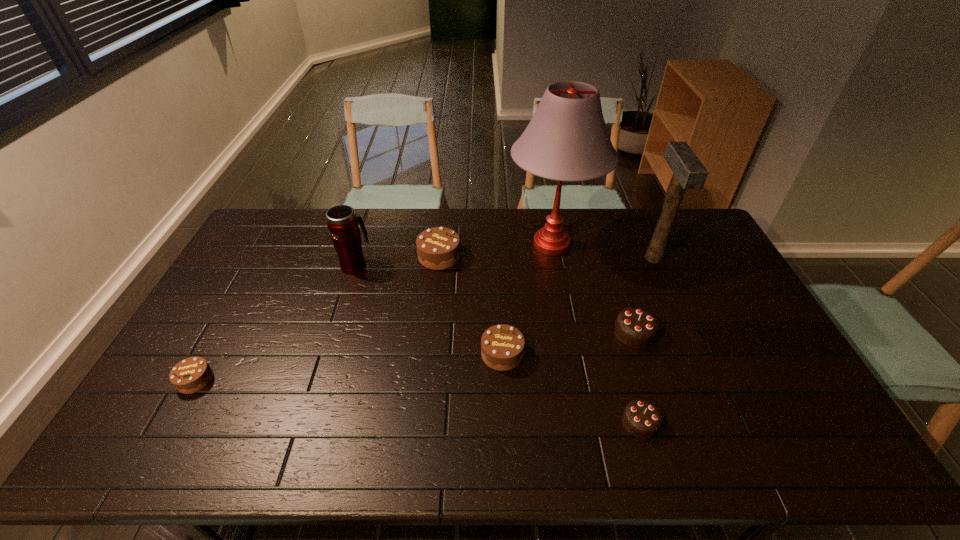
Where is `brown chocolate cake that stands as the second closest to the rightmost brown chocolate cake`? brown chocolate cake that stands as the second closest to the rightmost brown chocolate cake is located at coordinates (192, 374).

You are a GUI agent. You are given a task and a screenshot of the screen. Output one action in this format:
    pyautogui.click(x=<x>, y=<y>)
    Task: Click on the vacant region that satisfies the following two spatial constraints: 1. on the back side of the bigger chocolate chocolate cake; 2. on the left side of the smallest brown chocolate cake
    
    Given the screenshot: What is the action you would take?
    pyautogui.click(x=222, y=333)

Find the location of a particular element. free location that satisfies the following two spatial constraints: 1. on the back side of the rightmost object; 2. on the left side of the farther chocolate chocolate cake is located at coordinates (610, 258).